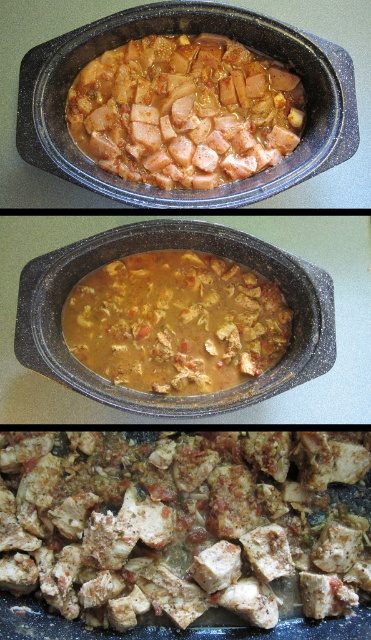
Question: Which object is the closest to the brown matte sausage at center?

Choices:
 (A) brown matte stew at center
 (B) brown matte diced meat at center

Answer: (A)

Question: Can you confirm if brown matte diced meat at center is positioned to the left of brown matte stew at center?

Choices:
 (A) no
 (B) yes

Answer: (A)

Question: Which point is farther to the camera?

Choices:
 (A) brown matte stew at center
 (B) brown matte diced meat at center
 (C) brown matte sausage at center

Answer: (C)

Question: Does brown matte diced meat at center have a lesser width compared to brown matte sausage at center?

Choices:
 (A) no
 (B) yes

Answer: (A)

Question: Does brown matte diced meat at center appear under brown matte sausage at center?

Choices:
 (A) no
 (B) yes

Answer: (B)

Question: Which point appears farthest from the camera in this image?

Choices:
 (A) (50, 541)
 (B) (224, 166)
 (C) (135, 292)

Answer: (B)